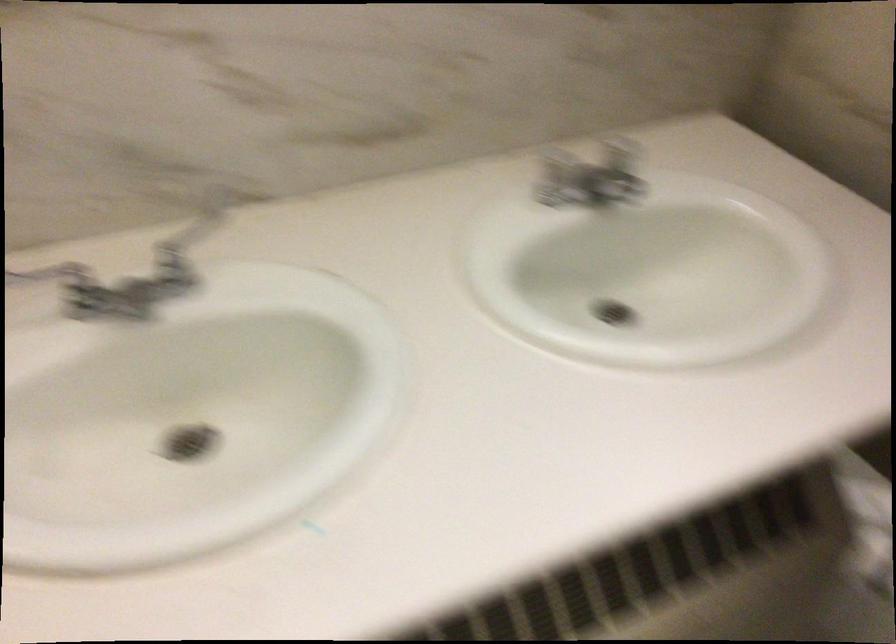
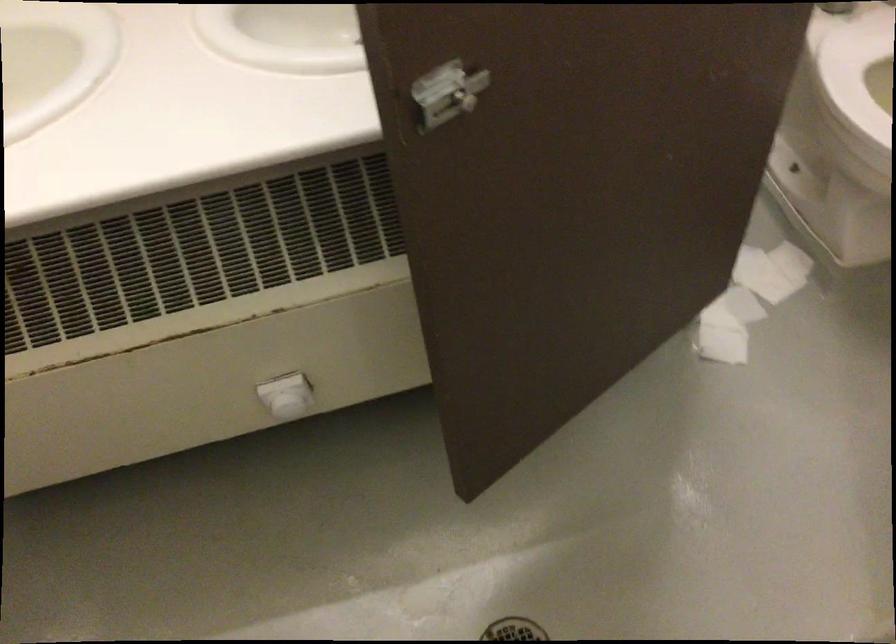
Question: Which direction would the cameraman need to move to produce the second image? Reply with the corresponding letter.

Choices:
 (A) Left
 (B) Right
 (C) Forward
 (D) Backward

Answer: (B)